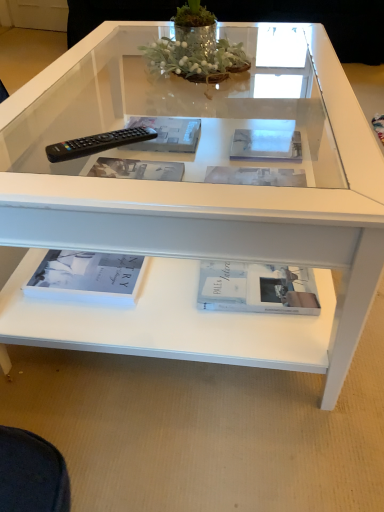
The width and height of the screenshot is (384, 512). I want to click on free space above white matte book at lower center, which is counted as the first book, starting from the right (from a real-world perspective), so click(x=256, y=279).